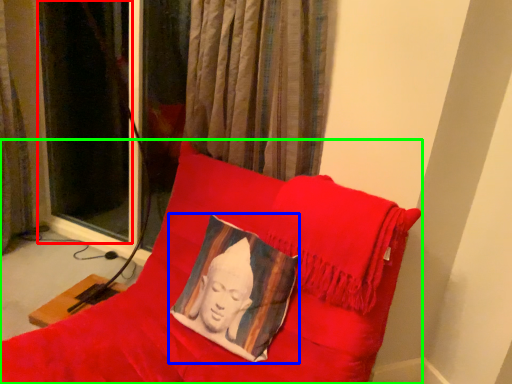
Question: Estimate the real-world distances between objects in this image. Which object is closer to curtain (highlighted by a red box), pillow (highlighted by a blue box) or furniture (highlighted by a green box)?

Choices:
 (A) pillow
 (B) furniture

Answer: (B)